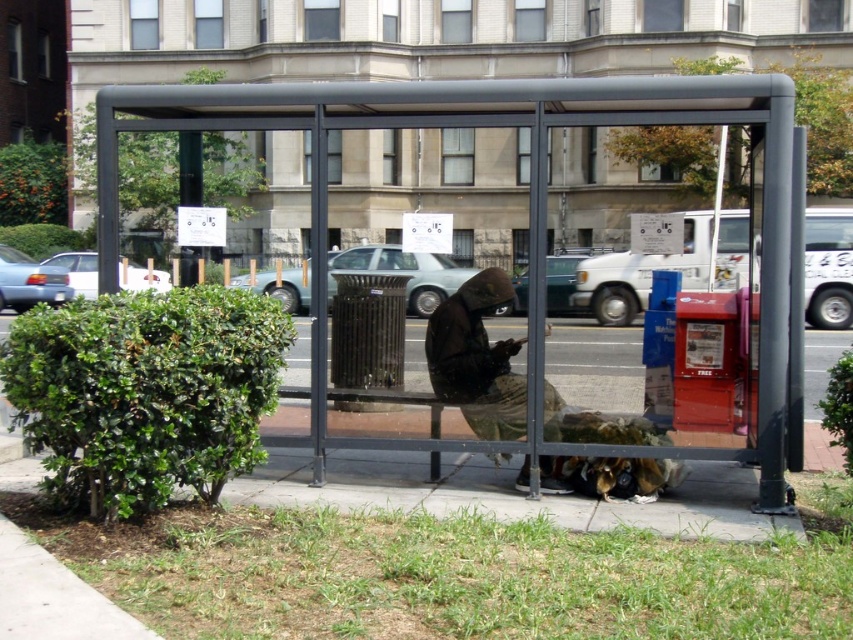
Can you confirm if matte black bus stop at center is smaller than camouflage fabric jacket at center?

Actually, matte black bus stop at center might be larger than camouflage fabric jacket at center.

Who is shorter, matte black bus stop at center or camouflage fabric jacket at center?

Standing shorter between the two is camouflage fabric jacket at center.

Who is more distant from viewer, (325, 172) or (477, 376)?

The point (477, 376) is behind.

Where is `matte black bus stop at center`? The width and height of the screenshot is (853, 640). matte black bus stop at center is located at coordinates (527, 195).